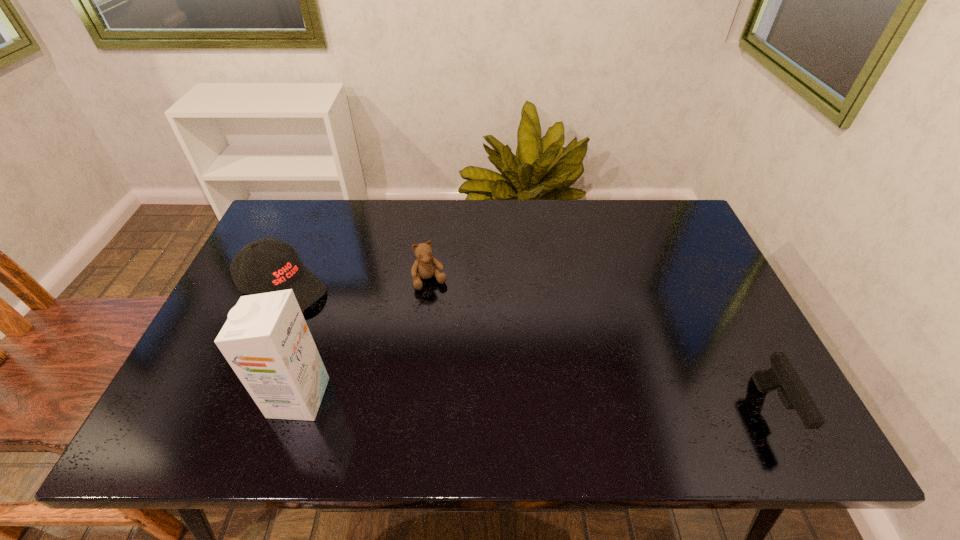
Where is `vacant spot on the desktop that is between the tallest object and the pistol and is positioned on the front-facing side of the baseball cap`? The width and height of the screenshot is (960, 540). vacant spot on the desktop that is between the tallest object and the pistol and is positioned on the front-facing side of the baseball cap is located at coordinates (466, 402).

The width and height of the screenshot is (960, 540). Find the location of `free spot on the desktop that is between the tallest object and the pistol and is positioned on the front-facing side of the teddy bear`. free spot on the desktop that is between the tallest object and the pistol and is positioned on the front-facing side of the teddy bear is located at coordinates (484, 402).